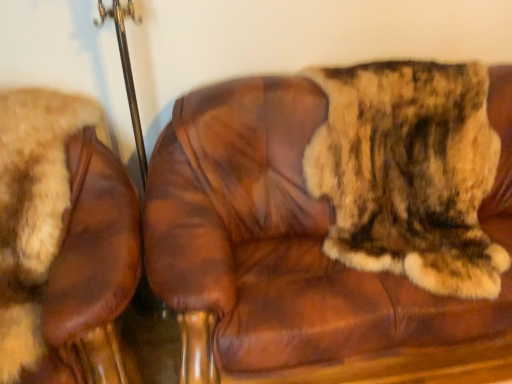
Question: Considering the relative sizes of brown leather chair at left, the 1th chair in the left-to-right sequence, and brown leather chair at center, which is the first chair in right-to-left order, in the image provided, is brown leather chair at left, the 1th chair in the left-to-right sequence, smaller than brown leather chair at center, which is the first chair in right-to-left order,?

Choices:
 (A) no
 (B) yes

Answer: (B)

Question: From a real-world perspective, is brown leather chair at left, positioned as the second chair in right-to-left order, located higher than brown leather chair at center, the 2th chair in the left-to-right sequence?

Choices:
 (A) no
 (B) yes

Answer: (A)

Question: From a real-world perspective, is brown leather chair at left, the 1th chair in the left-to-right sequence, physically below brown leather chair at center, which is the first chair in right-to-left order?

Choices:
 (A) yes
 (B) no

Answer: (A)

Question: Does brown leather chair at left, positioned as the second chair in right-to-left order, appear on the right side of brown leather chair at center, which is the first chair in right-to-left order?

Choices:
 (A) yes
 (B) no

Answer: (B)

Question: Does brown leather chair at left, positioned as the second chair in right-to-left order, touch brown leather chair at center, the 2th chair in the left-to-right sequence?

Choices:
 (A) no
 (B) yes

Answer: (A)

Question: Considering the relative sizes of brown leather chair at left, the 1th chair in the left-to-right sequence, and brown leather chair at center, which is the first chair in right-to-left order, in the image provided, is brown leather chair at left, the 1th chair in the left-to-right sequence, taller than brown leather chair at center, which is the first chair in right-to-left order,?

Choices:
 (A) yes
 (B) no

Answer: (B)

Question: Is fuzzy brown fur at right with brown leather chair at center, which is the first chair in right-to-left order?

Choices:
 (A) no
 (B) yes

Answer: (A)

Question: Is the position of fuzzy brown fur at right less distant than that of brown leather chair at center, the 2th chair in the left-to-right sequence?

Choices:
 (A) no
 (B) yes

Answer: (A)

Question: Is fuzzy brown fur at right thinner than brown leather chair at center, which is the first chair in right-to-left order?

Choices:
 (A) yes
 (B) no

Answer: (A)

Question: Can you confirm if fuzzy brown fur at right is smaller than brown leather chair at center, the 2th chair in the left-to-right sequence?

Choices:
 (A) yes
 (B) no

Answer: (A)

Question: From a real-world perspective, is fuzzy brown fur at right below brown leather chair at center, the 2th chair in the left-to-right sequence?

Choices:
 (A) no
 (B) yes

Answer: (A)

Question: Is the position of fuzzy brown fur at right more distant than that of brown leather chair at center, which is the first chair in right-to-left order?

Choices:
 (A) no
 (B) yes

Answer: (B)

Question: From the image's perspective, would you say brown leather chair at center, the 2th chair in the left-to-right sequence, is shown under brown leather chair at left, positioned as the second chair in right-to-left order?

Choices:
 (A) yes
 (B) no

Answer: (B)